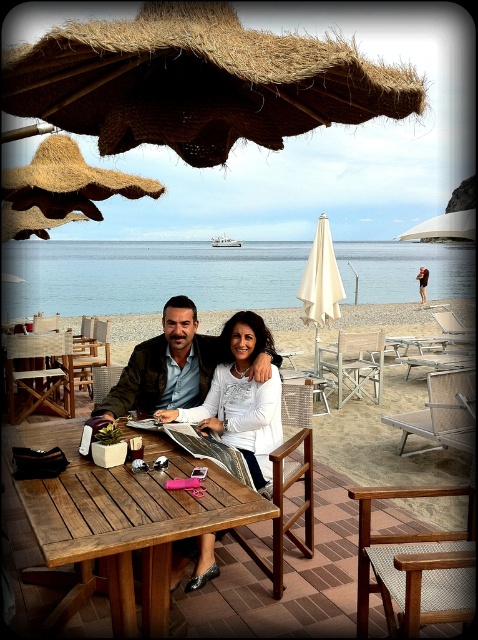
You are a photographer standing at the beachside setting. You want to take a closeup photo of the white matte dress at center. What is the minimum distance you need to move forward to ensure the dress is in focus?

The white matte dress at center is 2.91 meters away from the camera. To take a closeup photo, you need to move forward to reduce the distance between the camera and the dress. However, the exact minimum distance depends on the camera lens and focus settings. Since the description only provides the current distance, the answer should state that the dress is currently 2.91 meters away and moving closer would help achieve focus, but precise distance requirements depend on the camera equipment.

You are a delivery person standing at the entrance of the beachside cafe. You need to deliver a package to the table under the thatched straw umbrella at upper center. The package is 1.8 meters long. Can you carry the package horizontally from the entrance to the table without bending it?

The distance between the thatched straw umbrella at upper center and the viewer is 1.77 meters. Since the package is 1.8 meters long, which is slightly longer than the available space, you cannot carry it horizontally without bending it.